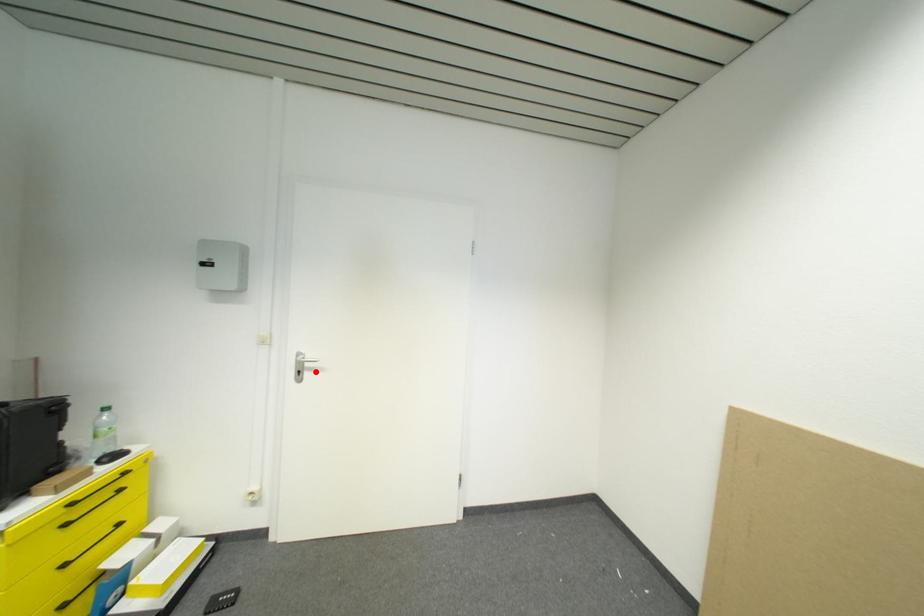
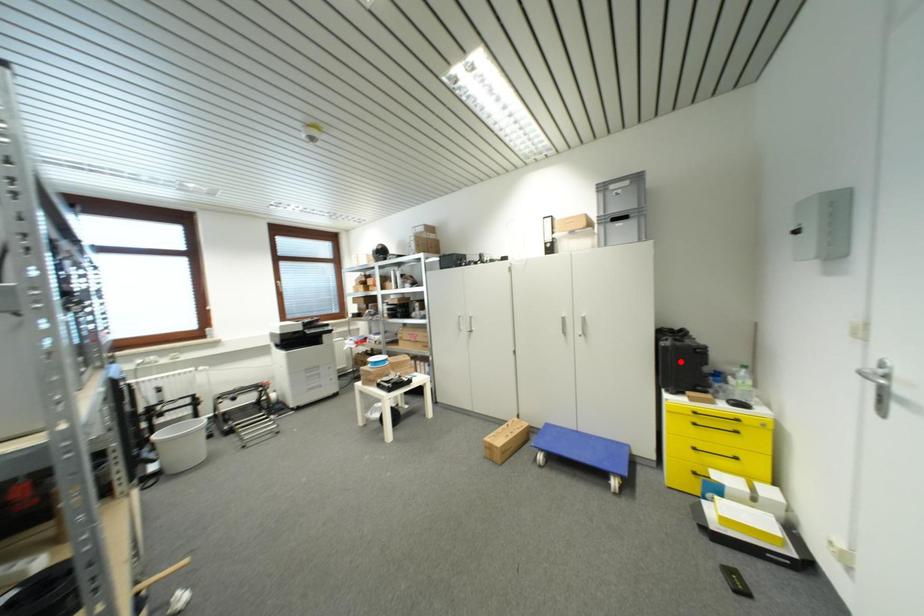
I am providing you with two images of the same scene from different viewpoints. A red point is marked on the first image and another point is marked on the second image. Are the points marked in image1 and image2 representing the same 3D position?

No